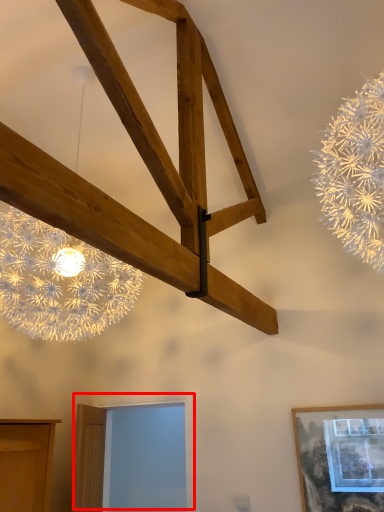
Question: From the image's perspective, where is window (annotated by the red box) located in relation to picture frame in the image?

Choices:
 (A) below
 (B) above

Answer: (A)